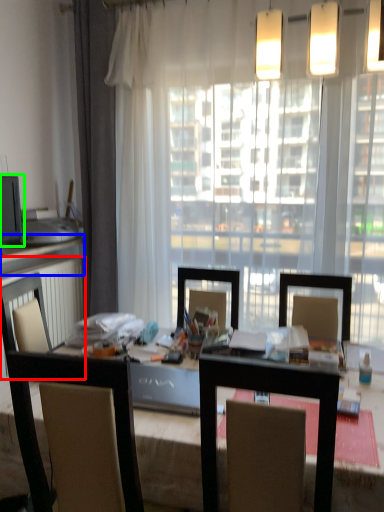
Question: Based on their relative distances, which object is farther from radiator (highlighted by a red box)? Choose from counter top (highlighted by a blue box) and computer monitor (highlighted by a green box).

Choices:
 (A) counter top
 (B) computer monitor

Answer: (B)